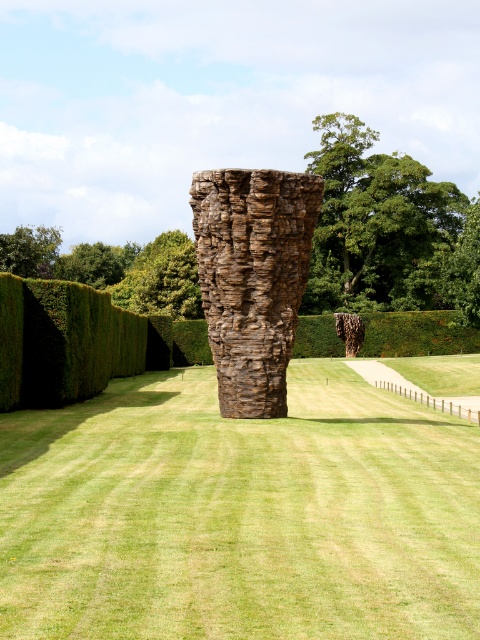
Question: Can you confirm if green grass at center is bigger than green leafy tree at upper center?

Choices:
 (A) yes
 (B) no

Answer: (B)

Question: Does green grass at center have a greater width compared to green leafy tree at upper center?

Choices:
 (A) no
 (B) yes

Answer: (A)

Question: Is brown textured rock at center positioned before green leafy tree at upper center?

Choices:
 (A) yes
 (B) no

Answer: (A)

Question: Considering the real-world distances, which object is closest to the green grass at center?

Choices:
 (A) green leafy tree at upper center
 (B) green leafy tree at upper left

Answer: (A)

Question: Based on their relative distances, which object is farther from the brown textured rock at center?

Choices:
 (A) green leafy tree at upper center
 (B) green leafy tree at upper left
 (C) green grass at center

Answer: (B)

Question: Estimate the real-world distances between objects in this image. Which object is closer to the green grass at center?

Choices:
 (A) green leafy tree at upper center
 (B) brown textured rock at center
 (C) green leafy tree at upper left

Answer: (B)